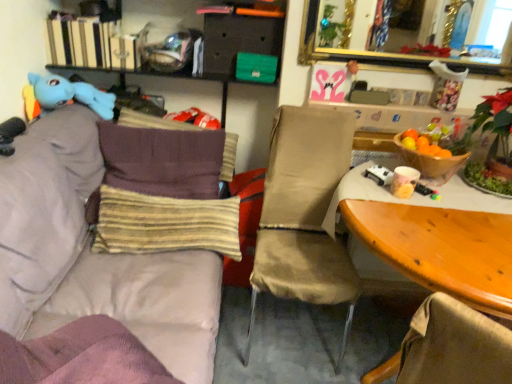
Question: Is wooden table at right in front of or behind brown striped pillow at left, which appears as the first pillow when viewed from the back, in the image?

Choices:
 (A) behind
 (B) front

Answer: (B)

Question: Considering the positions of wooden table at right and brown striped pillow at left, which appears as the first pillow when viewed from the back, in the image, is wooden table at right taller or shorter than brown striped pillow at left, which appears as the first pillow when viewed from the back,?

Choices:
 (A) tall
 (B) short

Answer: (A)

Question: Which object is positioned closest to the hardcover books at upper left?

Choices:
 (A) yellow striped fabric pillow at center, the first pillow viewed from the front
 (B) beige fabric chair at center
 (C) wooden table at right
 (D) gold-framed mirror at upper center
 (E) brown striped pillow at left, which appears as the first pillow when viewed from the back

Answer: (E)

Question: Estimate the real-world distances between objects in this image. Which object is closer to the beige fabric chair at center?

Choices:
 (A) yellow striped fabric pillow at center, arranged as the second pillow when viewed from the back
 (B) gold-framed mirror at upper center
 (C) matte black drawer at upper center
 (D) blue plush toy at upper left
 (E) light purple fabric couch at left

Answer: (A)